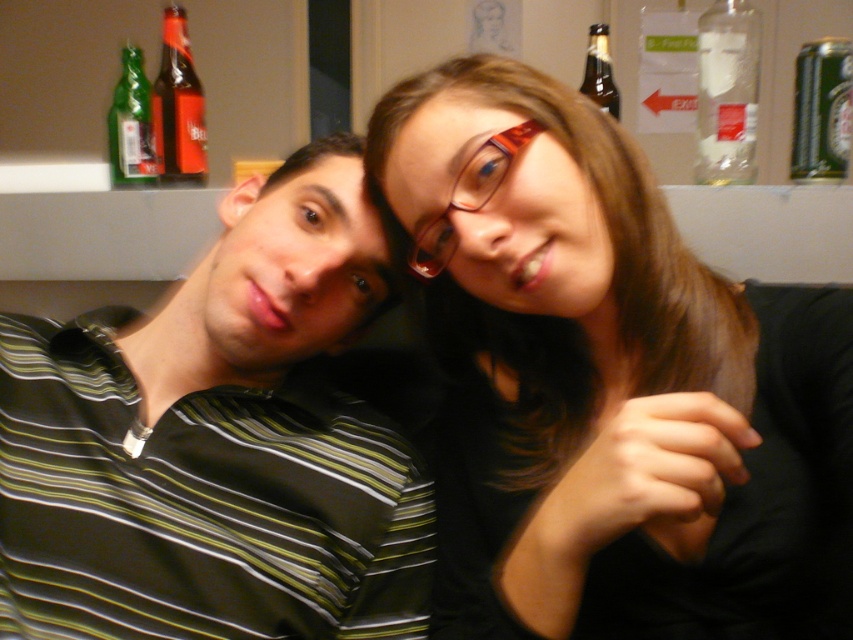
Question: Among these objects, which one is nearest to the camera?

Choices:
 (A) brown glass bottle at upper right
 (B) transparent glass bottle at upper right
 (C) translucent red glasses at center
 (D) green metallic can at upper right

Answer: (C)

Question: Among these points, which one is nearest to the camera?

Choices:
 (A) (169, 156)
 (B) (589, 58)

Answer: (B)

Question: Among these points, which one is nearest to the camera?

Choices:
 (A) (723, 177)
 (B) (604, 72)
 (C) (810, 61)
 (D) (408, 170)

Answer: (D)

Question: Is striped cotton shirt at left closer to the viewer compared to transparent glass bottle at upper right?

Choices:
 (A) yes
 (B) no

Answer: (A)

Question: Is striped cotton shirt at left positioned before translucent red glasses at center?

Choices:
 (A) no
 (B) yes

Answer: (A)

Question: Does matte glass bottle at upper left have a greater width compared to brown glass bottle at upper right?

Choices:
 (A) no
 (B) yes

Answer: (B)